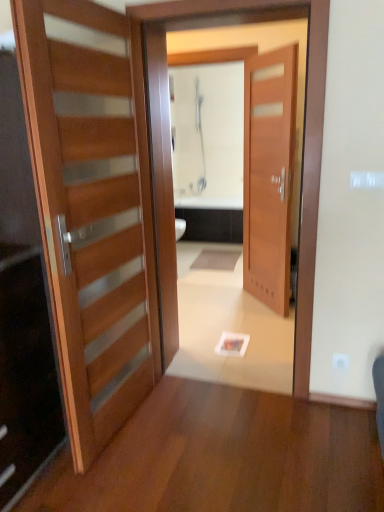
Question: Is wooden door at center, which is the 1th door in back-to-front order, bigger or smaller than wooden door at left, which ranks as the 2th door in right-to-left order?

Choices:
 (A) small
 (B) big

Answer: (A)

Question: Do you think wooden door at center, positioned as the 1th door in right-to-left order, is within wooden door at left, which is the 2th door from back to front, or outside of it?

Choices:
 (A) inside
 (B) outside

Answer: (B)

Question: Estimate the real-world distances between objects in this image. Which object is closer to the wooden door at left, placed as the 1th door when sorted from left to right?

Choices:
 (A) wooden door at center
 (B) wooden door at center, positioned as the 1th door in right-to-left order

Answer: (A)

Question: Which of these objects is positioned farthest from the wooden door at center, positioned as the 1th door in right-to-left order?

Choices:
 (A) wooden door at center
 (B) wooden door at left, placed as the 1th door when sorted from left to right

Answer: (B)